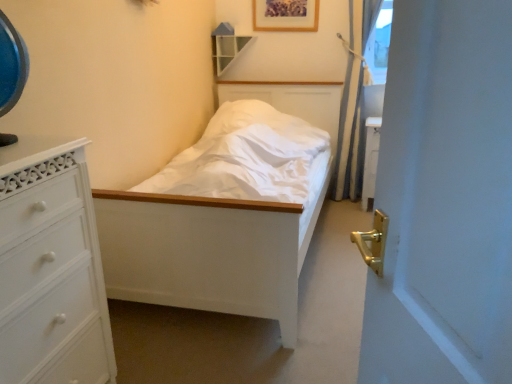
Question: In terms of height, does wooden picture frame at upper center look taller or shorter compared to blue fabric curtain at right?

Choices:
 (A) tall
 (B) short

Answer: (B)

Question: Is wooden picture frame at upper center situated inside blue fabric curtain at right or outside?

Choices:
 (A) inside
 (B) outside

Answer: (B)

Question: Based on their relative distances, which object is nearer to the wooden shelf at upper center?

Choices:
 (A) white painted wood bed at center
 (B) blue fabric curtain at right
 (C) white painted wood chest of drawers at left
 (D) wooden picture frame at upper center

Answer: (D)

Question: Which is nearer to the wooden shelf at upper center?

Choices:
 (A) blue fabric curtain at right
 (B) white painted wood bed at center
 (C) wooden picture frame at upper center
 (D) white painted wood chest of drawers at left

Answer: (C)